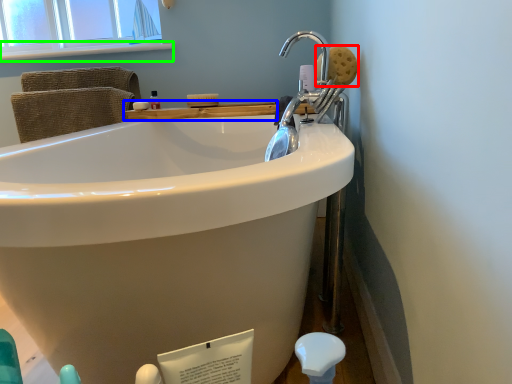
Question: Based on their relative distances, which object is farther from soap (highlighted by a red box)? Choose from counter top (highlighted by a blue box) and window sill (highlighted by a green box).

Choices:
 (A) counter top
 (B) window sill

Answer: (B)